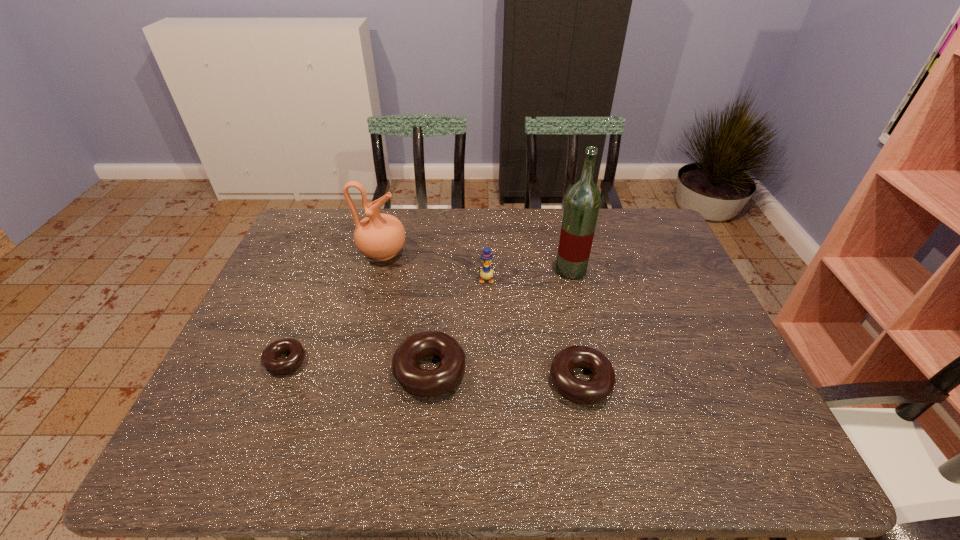
Where is `the shortest doughnut`? the shortest doughnut is located at coordinates (269, 360).

At what (x,y) coordinates should I click in order to perform the action: click on the leftmost doughnut. Please return your answer as a coordinate pair (x, y). This screenshot has height=540, width=960. Looking at the image, I should click on (269, 360).

Where is `the second doughnut from right to left`? The image size is (960, 540). the second doughnut from right to left is located at coordinates (428, 383).

This screenshot has height=540, width=960. Identify the location of the second shortest doughnut. (598, 388).

The height and width of the screenshot is (540, 960). What are the coordinates of `the second shortest object` in the screenshot? It's located at (598, 388).

This screenshot has width=960, height=540. Find the location of `the fifth object from right to left`. the fifth object from right to left is located at coordinates (379, 236).

Where is `the fifth shortest object`? Image resolution: width=960 pixels, height=540 pixels. the fifth shortest object is located at coordinates (379, 236).

This screenshot has height=540, width=960. Identify the location of liquor. (x=582, y=203).

In order to click on duckling in this screenshot , I will do `click(486, 273)`.

Locate an element on the screen. Image resolution: width=960 pixels, height=540 pixels. the third tallest object is located at coordinates (486, 273).